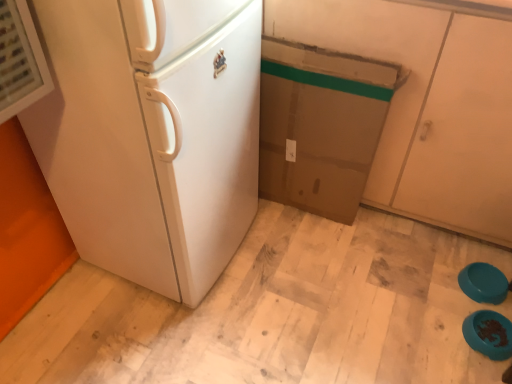
Where is `free space to the back side of teal plastic bowls at lower right, which appears as the 1th appliance when viewed from the back`? free space to the back side of teal plastic bowls at lower right, which appears as the 1th appliance when viewed from the back is located at coordinates (462, 249).